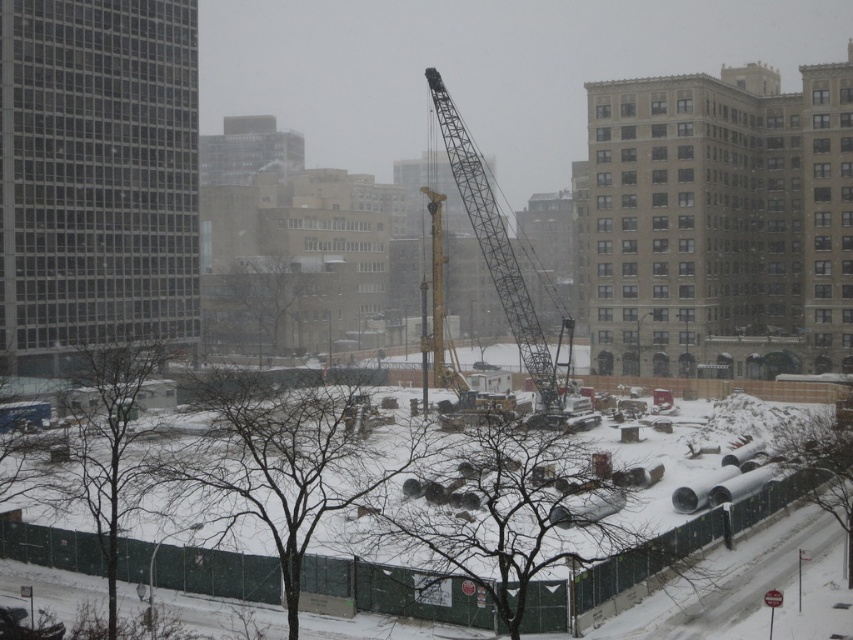
Is point (209, 572) positioned before point (422, 355)?

Yes, it is in front of point (422, 355).

Is point (590, 573) positioned behind point (440, 246)?

No, (590, 573) is in front of (440, 246).

The width and height of the screenshot is (853, 640). Identify the location of snowy concrete pipes at center. coord(659,552).

I want to click on snowy concrete pipes at center, so click(x=659, y=552).

Between snowy concrete pipes at center and metallic gray crane at center, which one is positioned lower?

snowy concrete pipes at center is below.

Identify the location of snowy concrete pipes at center. (659, 552).

Does metallic gray crane at center have a larger size compared to yellow metallic crane at center?

Yes.

In the scene shown: Is metallic gray crane at center thinner than yellow metallic crane at center?

No, metallic gray crane at center is not thinner than yellow metallic crane at center.

What do you see at coordinates (498, 257) in the screenshot?
I see `metallic gray crane at center` at bounding box center [498, 257].

Where is `metallic gray crane at center`? metallic gray crane at center is located at coordinates (498, 257).